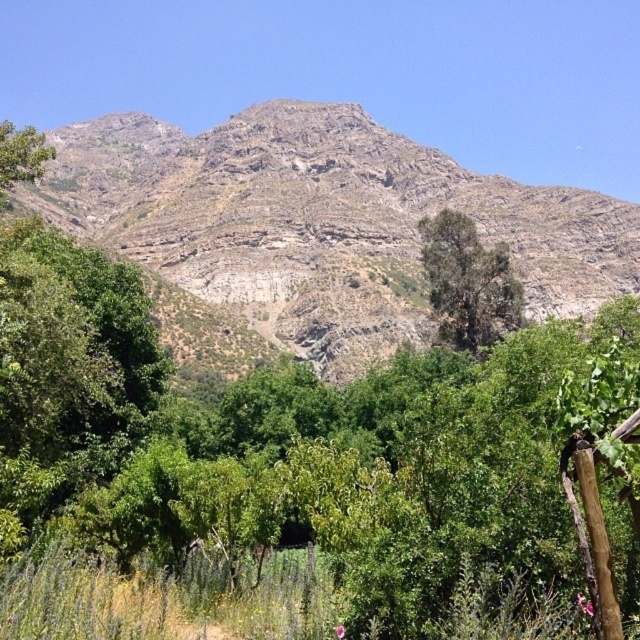
You are standing in the lush green area and want to take a photo of the rocky gray mountain at upper center and the green leafy tree at center. Which object should you frame first in your camera to ensure both are in the shot?

You should frame the rocky gray mountain at upper center first because it is positioned to the left of the green leafy tree at center, so starting with the left side ensures both are included in the shot.

You are standing at the base of the mountain in the image. Looking up, you notice a specific point marked as point (316, 228). Which object in the scene does this point correspond to?

The point (316, 228) corresponds to the rocky gray mountain at upper center.

You are planning to set up a small garden between the green leafy tree at center and the green leafy tree at left. The garden requires a space of 60 meters between the two trees. Is the distance sufficient for your garden?

The distance between the green leafy tree at center and the green leafy tree at left is 58.55 meters, which is less than the required 60 meters. Therefore, the space is insufficient for the garden.